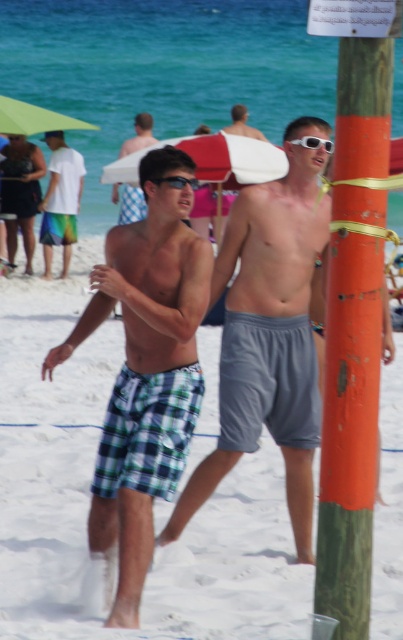
Which is in front, point (2, 512) or point (382, 196)?

Point (382, 196)

From the picture: Between plaid fabric shorts at center and green wood pole at right, which one is positioned higher?

green wood pole at right

Looking at this image, measure the distance between point (278, 602) and camera.

Point (278, 602) and camera are 18.02 feet apart from each other.

The image size is (403, 640). I want to click on plaid fabric shorts at center, so click(89, 497).

Does plaid shorts at center have a greater width compared to white plastic goggles at center?

Yes.

Does plaid shorts at center have a greater height compared to white plastic goggles at center?

Yes.

Does point (143, 118) come farther from viewer compared to point (330, 147)?

Yes, it is.

The image size is (403, 640). I want to click on plaid shorts at center, so click(132, 204).

Which is above, plaid fabric shorts at center or checkered fabric shorts at center?

checkered fabric shorts at center

Does plaid fabric shorts at center have a smaller size compared to checkered fabric shorts at center?

Actually, plaid fabric shorts at center might be larger than checkered fabric shorts at center.

Find the location of a particular element. plaid fabric shorts at center is located at coordinates (89, 497).